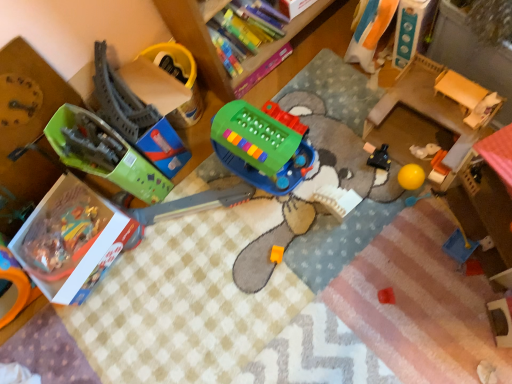
This screenshot has width=512, height=384. I want to click on vacant area that lies between green plastic toy at center, placed as the third toy when sorted from left to right, and blue plastic dustpan at lower right, which ranks as the 1th toy in right-to-left order, so click(374, 215).